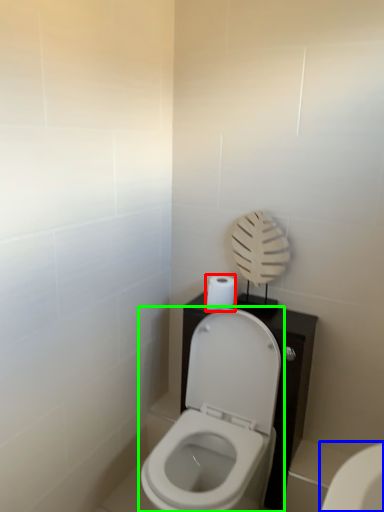
Question: Based on their relative distances, which object is farther from toilet paper (highlighted by a red box)? Choose from toilet (highlighted by a blue box) and toilet (highlighted by a green box).

Choices:
 (A) toilet
 (B) toilet

Answer: (A)